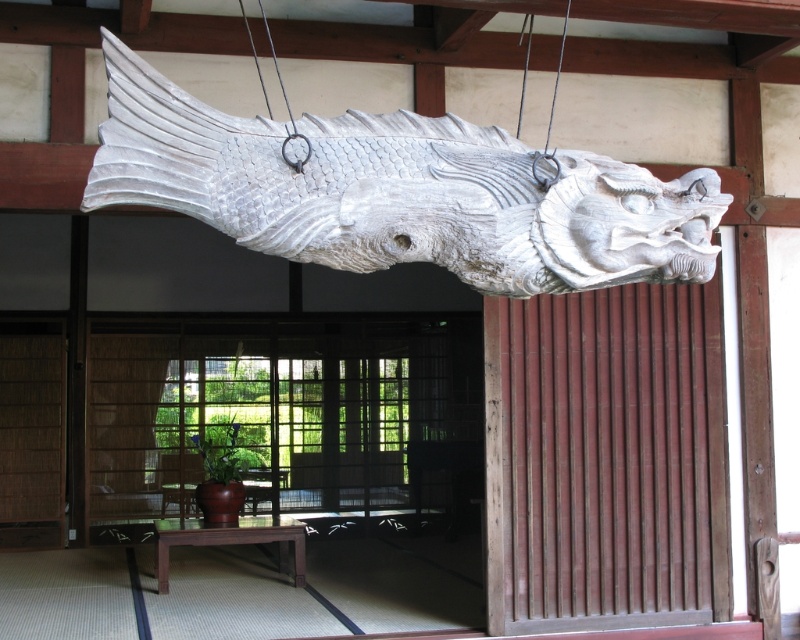
Who is shorter, wooden sliding door at center or white wood fish at center?

white wood fish at center is shorter.

Identify the location of wooden sliding door at center. (297, 468).